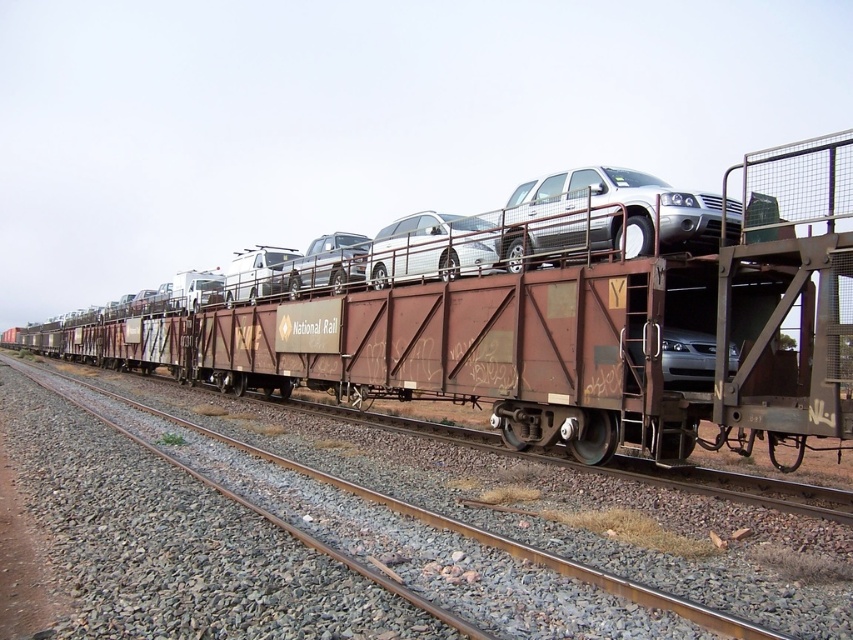
Who is higher up, rusty metal train track at center or silver metallic suv at upper center?

Positioned higher is silver metallic suv at upper center.

Can you confirm if rusty metal train track at center is wider than silver metallic suv at upper center?

Indeed, rusty metal train track at center has a greater width compared to silver metallic suv at upper center.

Is point (631, 605) more distant than point (730, 227)?

No.

The width and height of the screenshot is (853, 640). Find the location of `rusty metal train track at center`. rusty metal train track at center is located at coordinates (376, 532).

Is rusty metal train track at center above rusty metal train car at center?

No.

Locate an element on the screen. This screenshot has width=853, height=640. rusty metal train track at center is located at coordinates (376, 532).

What do you see at coordinates (376, 532) in the screenshot?
I see `rusty metal train track at center` at bounding box center [376, 532].

I want to click on rusty metal train track at center, so click(x=376, y=532).

Which is in front, point (677, 230) or point (339, 269)?

Point (677, 230) is in front.

Between silver metallic suv at upper center and satin silver truck at center, which one has less height?

With less height is silver metallic suv at upper center.

This screenshot has width=853, height=640. What do you see at coordinates (602, 216) in the screenshot?
I see `silver metallic suv at upper center` at bounding box center [602, 216].

Locate an element on the screen. Image resolution: width=853 pixels, height=640 pixels. silver metallic suv at upper center is located at coordinates (602, 216).